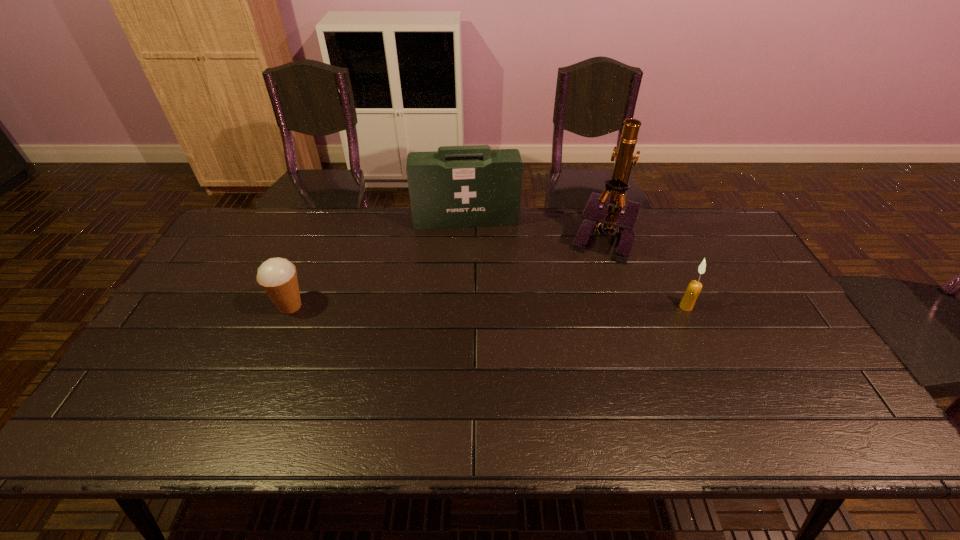
Where is `vacant space at the far right corner`? vacant space at the far right corner is located at coordinates (678, 220).

Locate an element on the screen. free space at the near right corner is located at coordinates (804, 384).

Locate an element on the screen. The height and width of the screenshot is (540, 960). empty space between the rightmost object and the second object from right to left is located at coordinates (643, 272).

At what (x,y) coordinates should I click in order to perform the action: click on free space between the third object from left to right and the third object from right to left. Please return your answer as a coordinate pair (x, y). The width and height of the screenshot is (960, 540). Looking at the image, I should click on (534, 229).

This screenshot has height=540, width=960. Identify the location of vacant area between the first-aid kit and the icecream. (378, 264).

Locate an element on the screen. vacant region between the third object from right to left and the leftmost object is located at coordinates (378, 264).

You are a GUI agent. You are given a task and a screenshot of the screen. Output one action in this format:
    pyautogui.click(x=<x>, y=<y>)
    Task: Click on the unoccupied position between the microscope and the leftmost object
    Image resolution: width=960 pixels, height=540 pixels.
    Given the screenshot: What is the action you would take?
    pyautogui.click(x=445, y=272)

This screenshot has width=960, height=540. I want to click on vacant area that lies between the second object from right to left and the icecream, so click(445, 272).

Identify the location of free space between the icecream and the candle. (488, 306).

Locate an element on the screen. The height and width of the screenshot is (540, 960). free spot between the third shortest object and the icecream is located at coordinates (378, 264).